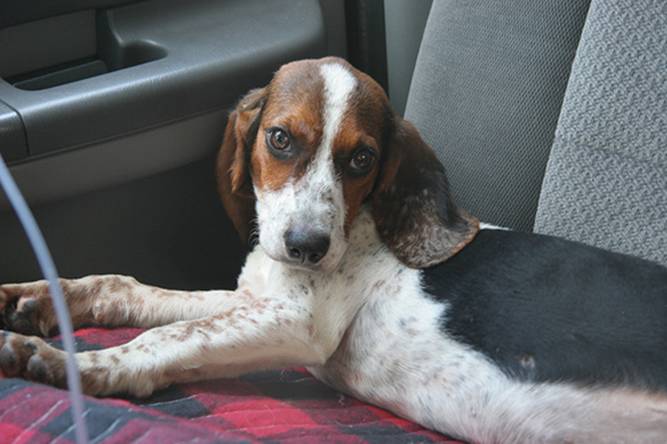
I want to click on arm rest, so click(x=215, y=42).